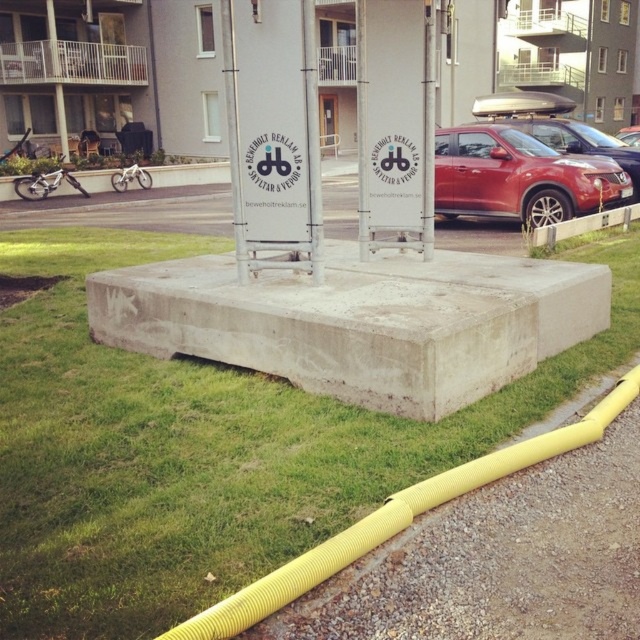
You are a delivery person trying to park your matte red car at right near the concrete curb at lower right. Based on the scene description, can your car fit next to the curb without overhanging? Please explain.

The matte red car at right is bigger than the concrete curb at lower right. However, the size comparison alone does not determine if the car can fit next to the curb. The scene mentions a gravel path and a bright yellow corrugated pipe along its edge, suggesting limited space. Without specific measurements of the path width, it is uncertain if the car will overhang. Consider checking the available space before parking.

You are standing at the point marked as point (x=49, y=627). You need to walk to the nearest building entrance. The nearest building entrance is located 2.65 meters away from your current position. Is the entrance to the building within a 3 meter radius from your current location?

Yes, the nearest building entrance is 2.65 meters away from point (x=49, y=627), which is within the 3 meter radius.

Based on the photo, you are standing at the center of the gravel path and want to reach the green grass at lower left. Which direction should you move to get there?

The green grass at lower left is located at point (204,449), so you should move towards the lower left direction to reach it.